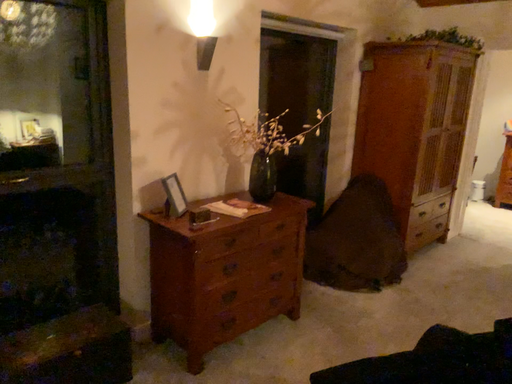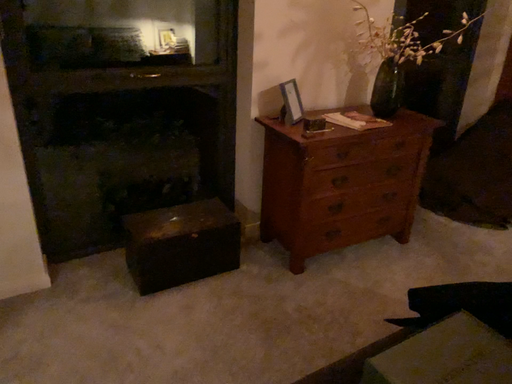
Question: Which way did the camera rotate in the video?

Choices:
 (A) rotated right
 (B) rotated left

Answer: (B)